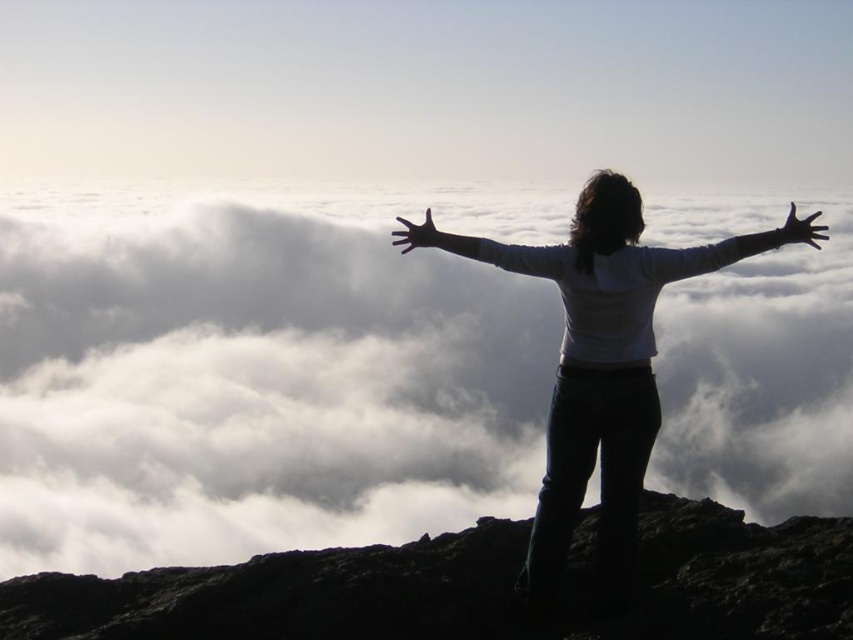
Can you confirm if silhouette jeans at center is bigger than silvery metallic arm at upper right?

Yes, silhouette jeans at center is bigger than silvery metallic arm at upper right.

Between point (575, 348) and point (712, 268), which one is positioned in front?

Positioned in front is point (712, 268).

Locate an element on the screen. This screenshot has width=853, height=640. silhouette jeans at center is located at coordinates (601, 369).

Is white fluffy cloud at upper center wider than black matte hand at upper right?

Yes.

Is point (415, 282) closer to camera compared to point (816, 227)?

No, it is behind (816, 227).

I want to click on white fluffy cloud at upper center, so click(x=260, y=372).

Can you confirm if rugged stone mountain at center is shorter than silhouette jeans at center?

No, rugged stone mountain at center is not shorter than silhouette jeans at center.

From the picture: Which is below, rugged stone mountain at center or silhouette jeans at center?

rugged stone mountain at center

Does point (49, 576) come behind point (560, 275)?

That is True.

The image size is (853, 640). I want to click on rugged stone mountain at center, so click(473, 588).